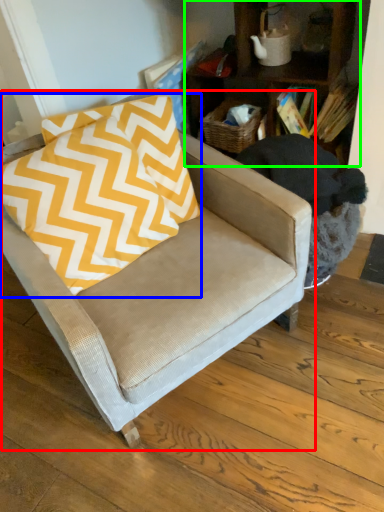
Question: Which object is positioned closest to chair (highlighted by a red box)? Select from pillow (highlighted by a blue box) and bookcase (highlighted by a green box).

Choices:
 (A) pillow
 (B) bookcase

Answer: (A)